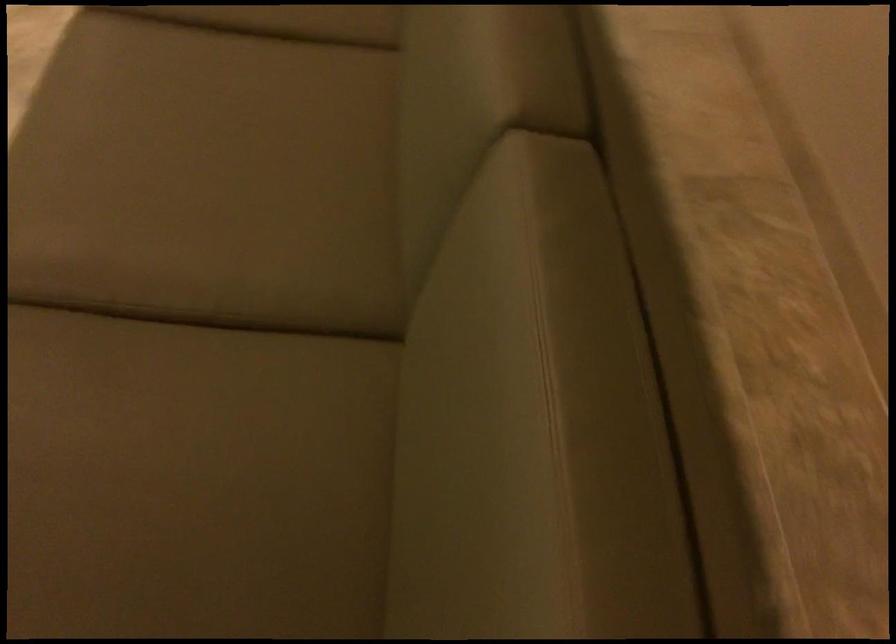
Where is `beige sofa armrest`? Image resolution: width=896 pixels, height=644 pixels. beige sofa armrest is located at coordinates (286, 20).